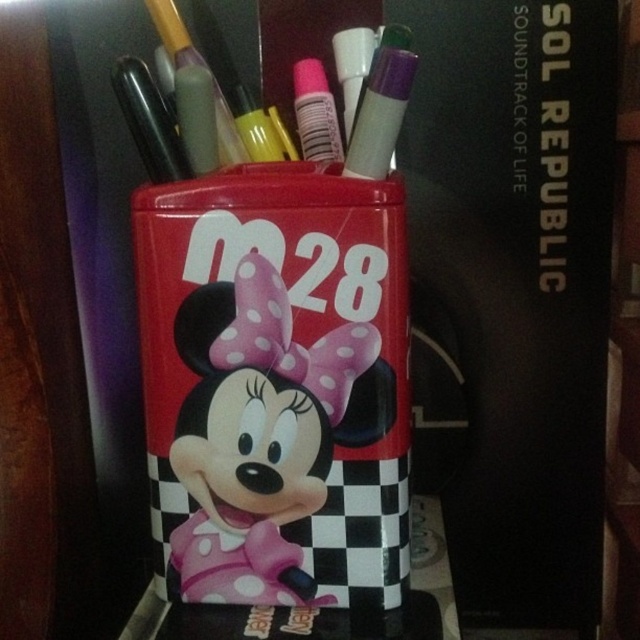
Question: Can you confirm if matte purple marker at center is positioned to the left of matte black pen at left?

Choices:
 (A) no
 (B) yes

Answer: (A)

Question: Which of the following is the closest to the observer?

Choices:
 (A) matte purple marker at center
 (B) matte black pen at left

Answer: (A)

Question: Can you confirm if matte plastic minnie mouse at center is wider than white matte marker at upper center?

Choices:
 (A) yes
 (B) no

Answer: (A)

Question: Is matte purple marker at center smaller than white matte marker at upper center?

Choices:
 (A) no
 (B) yes

Answer: (A)

Question: Which point appears closest to the camera in this image?

Choices:
 (A) (339, 45)
 (B) (198, 432)
 (C) (360, 138)
 (D) (147, 88)

Answer: (C)

Question: Among these objects, which one is nearest to the camera?

Choices:
 (A) matte purple marker at center
 (B) pink matte glue stick at center
 (C) white matte marker at upper center

Answer: (A)